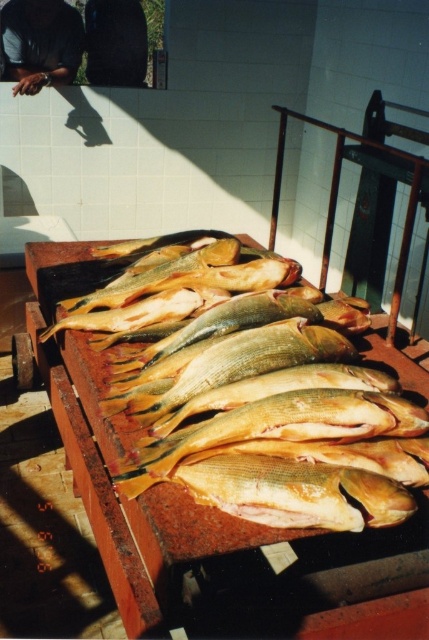
Question: Which point is farther to the camera?

Choices:
 (A) (390, 358)
 (B) (76, 65)

Answer: (B)

Question: Can you confirm if yellowish wood table at center is wider than dark skin smooth hand at upper left?

Choices:
 (A) no
 (B) yes

Answer: (B)

Question: Which point appears farthest from the camera in this image?

Choices:
 (A) (154, 572)
 (B) (66, 61)

Answer: (B)

Question: Is yellowish wood table at center further to the viewer compared to dark skin smooth hand at upper left?

Choices:
 (A) no
 (B) yes

Answer: (A)

Question: Which point is closer to the camera?

Choices:
 (A) dark skin smooth hand at upper left
 (B) yellowish wood table at center

Answer: (B)

Question: Is yellowish wood table at center positioned behind dark skin smooth hand at upper left?

Choices:
 (A) yes
 (B) no

Answer: (B)